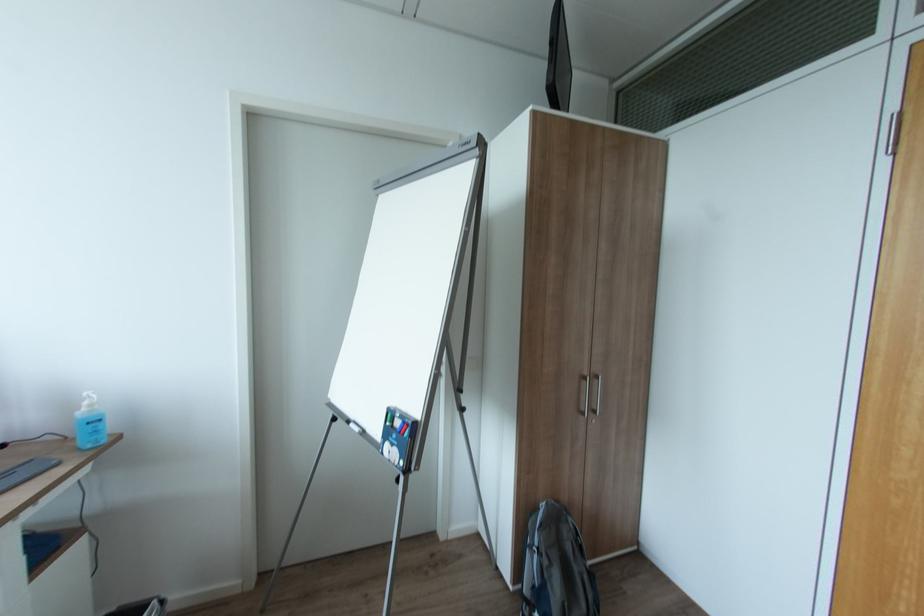
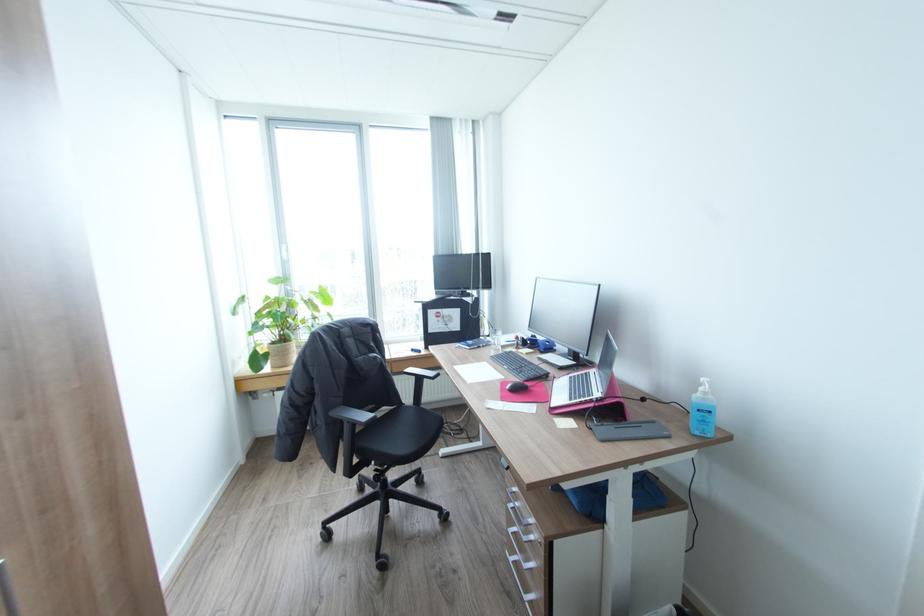
Question: How did the camera likely rotate?

Choices:
 (A) Left
 (B) Right
 (C) Up
 (D) Down

Answer: (A)